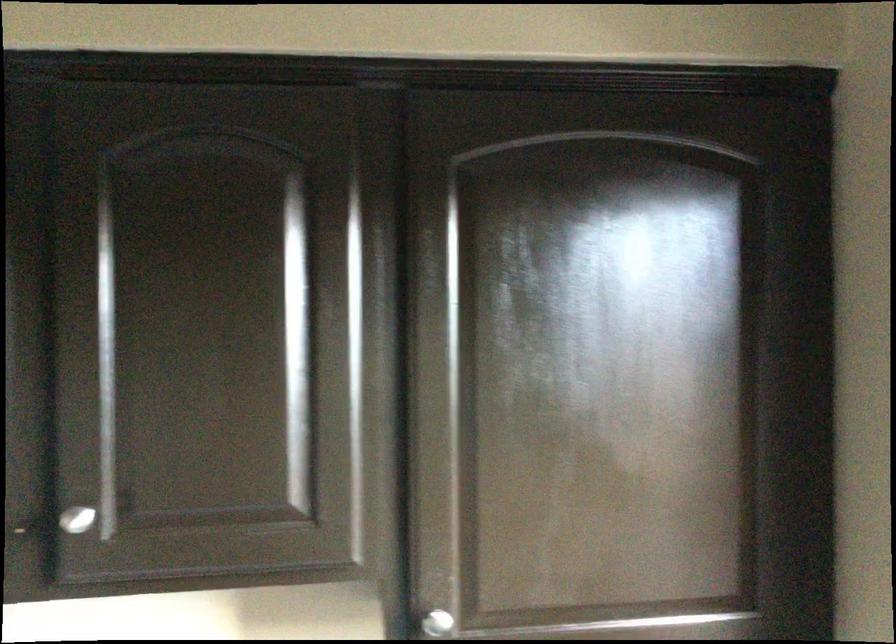
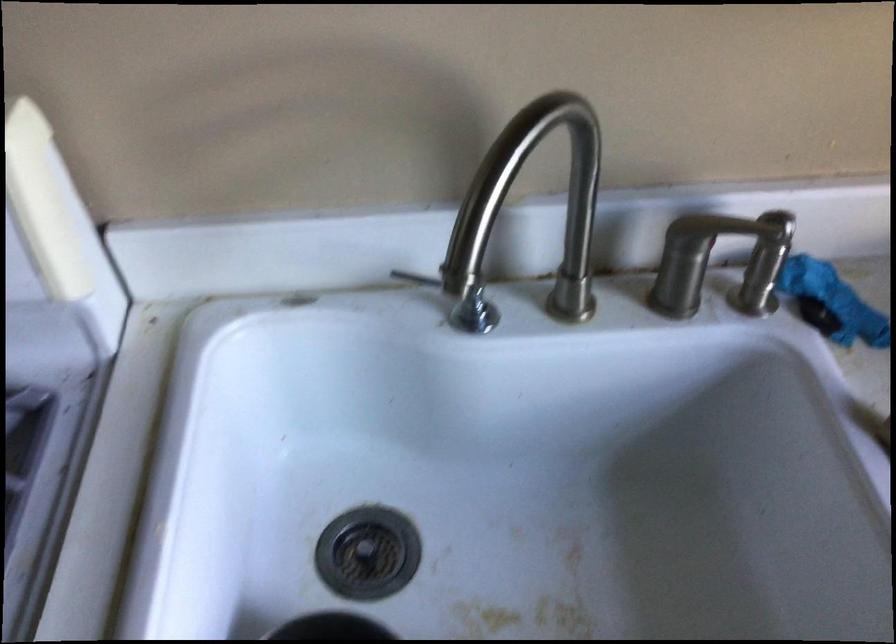
Question: The images are taken continuously from a first-person perspective. In which direction is your viewpoint rotating?

Choices:
 (A) Left
 (B) Right
 (C) Up
 (D) Down

Answer: (D)